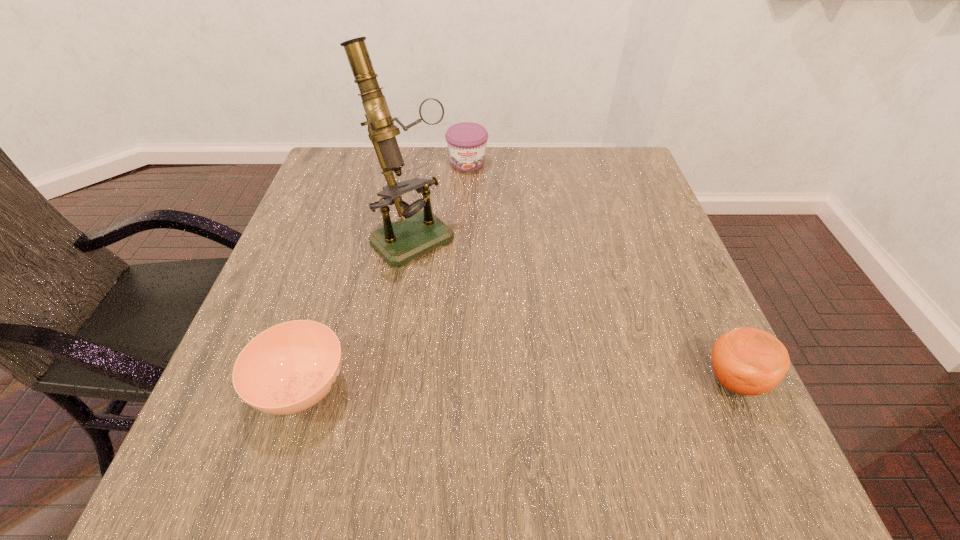
Identify the location of vacant space that satisfies the following two spatial constraints: 1. on the back side of the jam; 2. on the left side of the shortest object. This screenshot has width=960, height=540. (372, 163).

Identify the location of vacant area in the image that satisfies the following two spatial constraints: 1. on the front side of the third tallest object; 2. on the right side of the orange. The height and width of the screenshot is (540, 960). (460, 380).

Find the location of `blank area in the image that satisfies the following two spatial constraints: 1. on the front side of the farthest object; 2. on the right side of the third shortest object`. blank area in the image that satisfies the following two spatial constraints: 1. on the front side of the farthest object; 2. on the right side of the third shortest object is located at coordinates (460, 380).

The height and width of the screenshot is (540, 960). Find the location of `vacant area that satisfies the following two spatial constraints: 1. on the front side of the farthest object; 2. on the right side of the third shortest object`. vacant area that satisfies the following two spatial constraints: 1. on the front side of the farthest object; 2. on the right side of the third shortest object is located at coordinates (460, 380).

The width and height of the screenshot is (960, 540). I want to click on vacant area that satisfies the following two spatial constraints: 1. on the front side of the microscope; 2. on the left side of the second tallest object, so click(x=389, y=380).